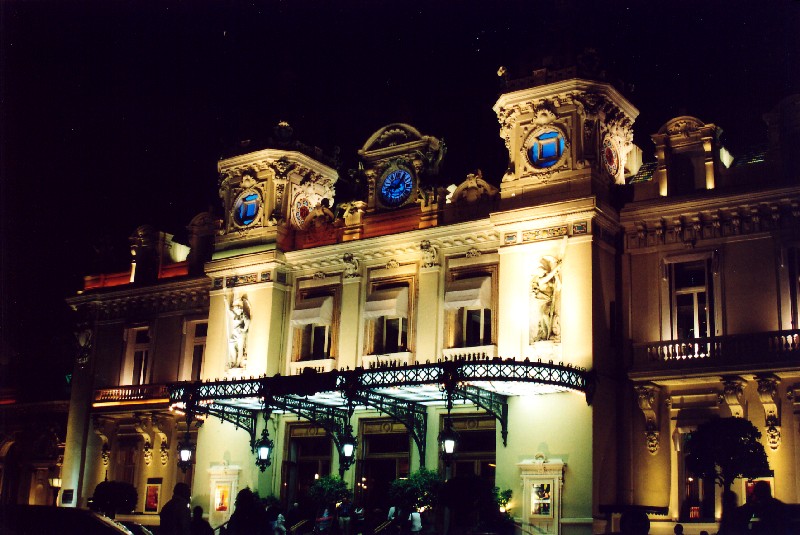
The width and height of the screenshot is (800, 535). I want to click on white clock face, so click(x=302, y=207), click(x=614, y=159).